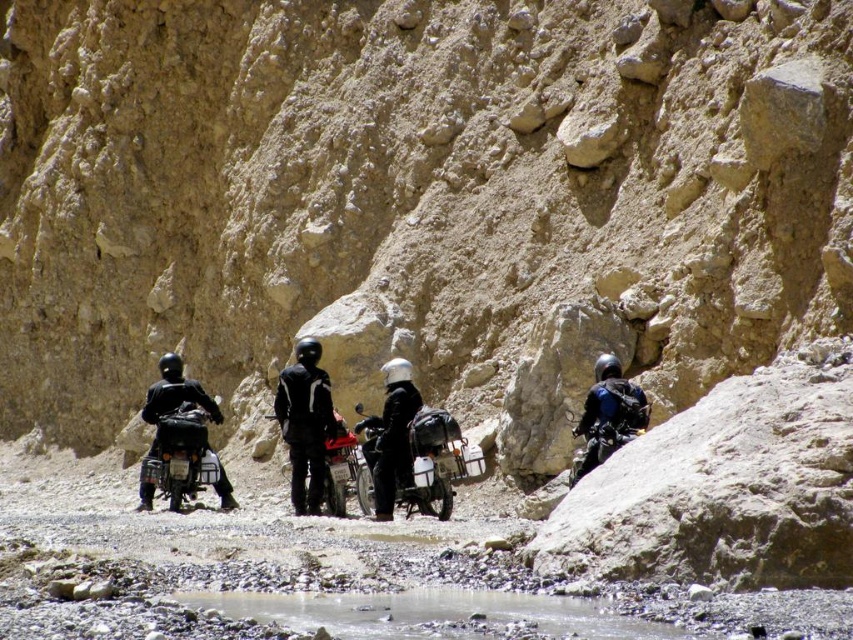
Question: Does white matte helmet at center appear on the left side of metallic silver motorcycle at center?

Choices:
 (A) no
 (B) yes

Answer: (A)

Question: Which of the following is the closest to the observer?

Choices:
 (A) white matte helmet at center
 (B) metallic silver motorcycle at center

Answer: (A)

Question: Which is nearer to the white matte helmet at center?

Choices:
 (A) metallic silver motorcycle at center
 (B) black matte jacket at center
 (C) matte black motorcycle at left

Answer: (A)

Question: Is black matte jacket at center positioned in front of matte black motorcycle at left?

Choices:
 (A) yes
 (B) no

Answer: (B)

Question: Does matte black motorcycle at left have a larger size compared to white matte helmet at center?

Choices:
 (A) no
 (B) yes

Answer: (B)

Question: Considering the real-world distances, which object is farthest from the matte black motorcycle at center?

Choices:
 (A) blue matte jacket at center
 (B) metallic silver motorcycle at center
 (C) black matte jacket at center
 (D) white matte helmet at center

Answer: (C)